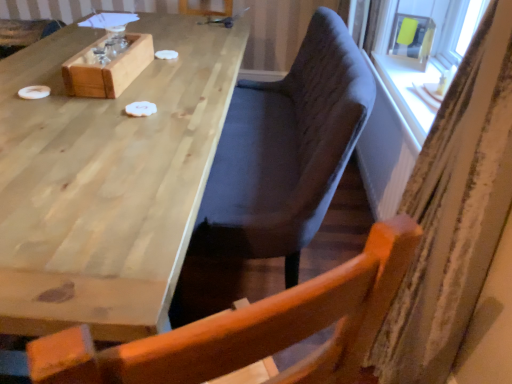
Question: Does striped fabric curtain at right have a greater height compared to matte yellow plastic at upper right?

Choices:
 (A) no
 (B) yes

Answer: (B)

Question: Is striped fabric curtain at right wider than matte yellow plastic at upper right?

Choices:
 (A) no
 (B) yes

Answer: (B)

Question: Does striped fabric curtain at right appear on the left side of matte yellow plastic at upper right?

Choices:
 (A) yes
 (B) no

Answer: (A)

Question: From the image's perspective, does striped fabric curtain at right appear higher than matte yellow plastic at upper right?

Choices:
 (A) no
 (B) yes

Answer: (A)

Question: From a real-world perspective, is striped fabric curtain at right positioned over matte yellow plastic at upper right based on gravity?

Choices:
 (A) no
 (B) yes

Answer: (A)

Question: From the image's perspective, is natural wood table at upper left positioned above or below matte yellow plastic at upper right?

Choices:
 (A) above
 (B) below

Answer: (B)

Question: Is natural wood table at upper left spatially inside matte yellow plastic at upper right, or outside of it?

Choices:
 (A) inside
 (B) outside

Answer: (B)

Question: Does point (102, 278) appear closer or farther from the camera than point (429, 29)?

Choices:
 (A) closer
 (B) farther

Answer: (A)

Question: Based on their sizes in the image, would you say natural wood table at upper left is bigger or smaller than matte yellow plastic at upper right?

Choices:
 (A) big
 (B) small

Answer: (A)

Question: Is point [431, 362] positioned closer to the camera than point [422, 28]?

Choices:
 (A) closer
 (B) farther

Answer: (A)

Question: In the image, is striped fabric curtain at right positioned in front of or behind matte yellow plastic at upper right?

Choices:
 (A) front
 (B) behind

Answer: (A)

Question: Considering the positions of striped fabric curtain at right and matte yellow plastic at upper right in the image, is striped fabric curtain at right taller or shorter than matte yellow plastic at upper right?

Choices:
 (A) tall
 (B) short

Answer: (A)

Question: In terms of width, does striped fabric curtain at right look wider or thinner when compared to matte yellow plastic at upper right?

Choices:
 (A) thin
 (B) wide

Answer: (B)

Question: Is natural wood table at upper left spatially inside striped fabric curtain at right, or outside of it?

Choices:
 (A) inside
 (B) outside

Answer: (B)

Question: Is natural wood table at upper left in front of or behind striped fabric curtain at right in the image?

Choices:
 (A) front
 (B) behind

Answer: (B)